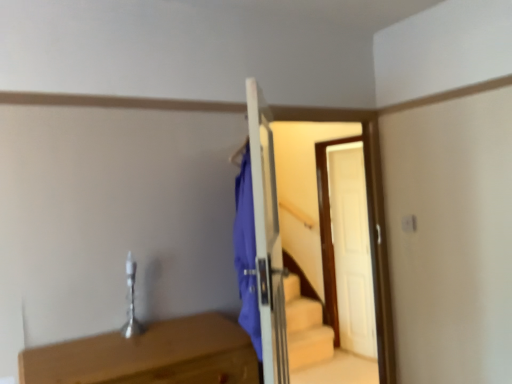
Find the location of a particular element. white wooden door at center is located at coordinates (379, 253).

Describe the element at coordinates (379, 253) in the screenshot. This screenshot has width=512, height=384. I see `white wooden door at center` at that location.

Where is `light brown wooden table at lower left`? This screenshot has height=384, width=512. light brown wooden table at lower left is located at coordinates (149, 355).

The width and height of the screenshot is (512, 384). Describe the element at coordinates (149, 355) in the screenshot. I see `light brown wooden table at lower left` at that location.

What is the approximate width of light brown wooden table at lower left?

light brown wooden table at lower left is 18.57 inches wide.

Find the location of a particular element. The width and height of the screenshot is (512, 384). white wooden door at center is located at coordinates (379, 253).

Based on the photo, between light brown wooden table at lower left and white wooden door at center, which one appears on the left side from the viewer's perspective?

light brown wooden table at lower left is more to the left.

Relative to white wooden door at center, is light brown wooden table at lower left in front or behind?

light brown wooden table at lower left is in front of white wooden door at center.

Is point (245, 334) closer to camera compared to point (366, 174)?

Yes, it is.

From the image's perspective, is light brown wooden table at lower left on top of white wooden door at center?

No, from the image's perspective, light brown wooden table at lower left is not over white wooden door at center.

From a real-world perspective, is light brown wooden table at lower left located higher than white wooden door at center?

No, from a real-world perspective, light brown wooden table at lower left is not above white wooden door at center.

In the scene shown: Considering the sizes of objects light brown wooden table at lower left and white wooden door at center in the image provided, who is wider, light brown wooden table at lower left or white wooden door at center?

light brown wooden table at lower left is wider.

In the scene shown: Considering the sizes of light brown wooden table at lower left and white wooden door at center in the image, is light brown wooden table at lower left taller or shorter than white wooden door at center?

Clearly, light brown wooden table at lower left is shorter compared to white wooden door at center.

Can you confirm if light brown wooden table at lower left is smaller than white wooden door at center?

Indeed, light brown wooden table at lower left has a smaller size compared to white wooden door at center.

Choose the correct answer: Is light brown wooden table at lower left inside white wooden door at center or outside it?

light brown wooden table at lower left is spatially situated outside white wooden door at center.

Is light brown wooden table at lower left placed right next to white wooden door at center?

No, light brown wooden table at lower left is not beside white wooden door at center.

Is light brown wooden table at lower left oriented towards white wooden door at center?

No, light brown wooden table at lower left is not turned towards white wooden door at center.

How different are the orientations of light brown wooden table at lower left and white wooden door at center in degrees?

83.4 degrees separate the facing orientations of light brown wooden table at lower left and white wooden door at center.

This screenshot has width=512, height=384. I want to click on door behind the light brown wooden table at lower left, so click(379, 253).

Considering the positions of objects white wooden door at center and light brown wooden table at lower left in the image provided, who is more to the left, white wooden door at center or light brown wooden table at lower left?

Positioned to the left is light brown wooden table at lower left.

Is white wooden door at center in front of light brown wooden table at lower left?

No, it is not.

Does point (266, 192) come farther from viewer compared to point (238, 360)?

No.

From the image's perspective, who appears lower, white wooden door at center or light brown wooden table at lower left?

light brown wooden table at lower left appears lower in the image.

From a real-world perspective, is white wooden door at center physically below light brown wooden table at lower left?

Actually, white wooden door at center is physically above light brown wooden table at lower left in the real world.

Between white wooden door at center and light brown wooden table at lower left, which one has larger width?

light brown wooden table at lower left is wider.

Does white wooden door at center have a lesser height compared to light brown wooden table at lower left?

No, white wooden door at center is not shorter than light brown wooden table at lower left.

Who is smaller, white wooden door at center or light brown wooden table at lower left?

Smaller between the two is light brown wooden table at lower left.

Is light brown wooden table at lower left inside white wooden door at center?

No, light brown wooden table at lower left is located outside of white wooden door at center.

Would you say white wooden door at center is a long distance from light brown wooden table at lower left?

white wooden door at center is near light brown wooden table at lower left, not far away.

Is white wooden door at center positioned with its back to light brown wooden table at lower left?

Yes, white wooden door at center is positioned with its back facing light brown wooden table at lower left.

What's the angular difference between white wooden door at center and light brown wooden table at lower left's facing directions?

The angle between the facing direction of white wooden door at center and the facing direction of light brown wooden table at lower left is 83.4 degrees.

This screenshot has height=384, width=512. I want to click on door that is behind the light brown wooden table at lower left, so click(x=379, y=253).

Image resolution: width=512 pixels, height=384 pixels. I want to click on door that is above the light brown wooden table at lower left (from a real-world perspective), so click(379, 253).

The width and height of the screenshot is (512, 384). I want to click on table in front of the white wooden door at center, so click(149, 355).